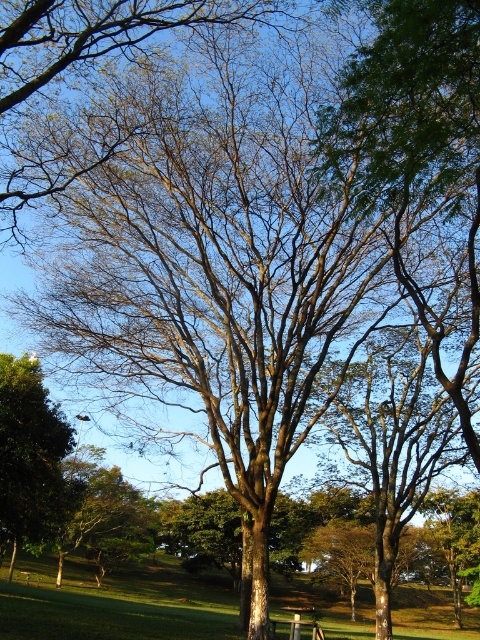
You are standing in the middle of the scene and want to take a photo of the green leafy tree at lower left without the green grass at center blocking the view. Which direction should you move to ensure the tree is fully visible?

You should move to the side away from the green grass at center so that the green leafy tree at lower left is no longer blocked by the grass. Since the green grass at center is in front of the tree, moving sideways can help position yourself where the grass is not obstructing the view.